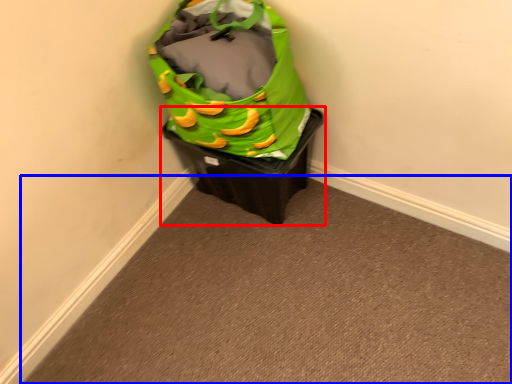
Question: Which of the following is the farthest to the observer, waste container (highlighted by a red box) or plain (highlighted by a blue box)?

Choices:
 (A) waste container
 (B) plain

Answer: (A)